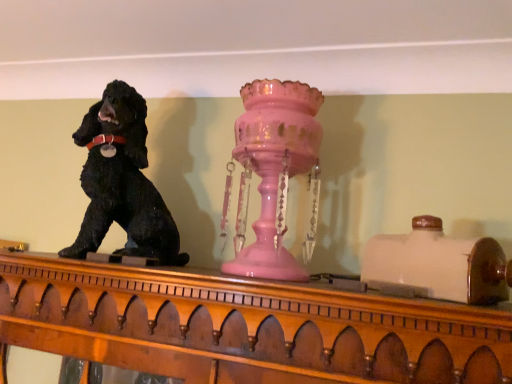
Question: Does black matte dog at left have a smaller size compared to pink glass candle holder at center?

Choices:
 (A) yes
 (B) no

Answer: (B)

Question: From the image's perspective, is black matte dog at left under pink glass candle holder at center?

Choices:
 (A) no
 (B) yes

Answer: (A)

Question: Is pink glass candle holder at center at the back of black matte dog at left?

Choices:
 (A) no
 (B) yes

Answer: (A)

Question: Is black matte dog at left at the right side of pink glass candle holder at center?

Choices:
 (A) no
 (B) yes

Answer: (A)

Question: Does black matte dog at left have a greater width compared to pink glass candle holder at center?

Choices:
 (A) no
 (B) yes

Answer: (B)

Question: Are black matte dog at left and pink glass candle holder at center located far from each other?

Choices:
 (A) no
 (B) yes

Answer: (A)

Question: Could black matte dog at left be considered to be inside pink glass candle holder at center?

Choices:
 (A) yes
 (B) no

Answer: (B)

Question: Does pink glass candle holder at center have a lesser width compared to black matte dog at left?

Choices:
 (A) no
 (B) yes

Answer: (B)

Question: From the image's perspective, is pink glass candle holder at center beneath black matte dog at left?

Choices:
 (A) yes
 (B) no

Answer: (A)

Question: Can you confirm if pink glass candle holder at center is positioned to the left of black matte dog at left?

Choices:
 (A) no
 (B) yes

Answer: (A)

Question: Is pink glass candle holder at center far away from black matte dog at left?

Choices:
 (A) yes
 (B) no

Answer: (B)

Question: Can you confirm if pink glass candle holder at center is positioned to the right of black matte dog at left?

Choices:
 (A) no
 (B) yes

Answer: (B)

Question: From the image's perspective, relative to pink glass candle holder at center, is black matte dog at left above or below?

Choices:
 (A) below
 (B) above

Answer: (B)